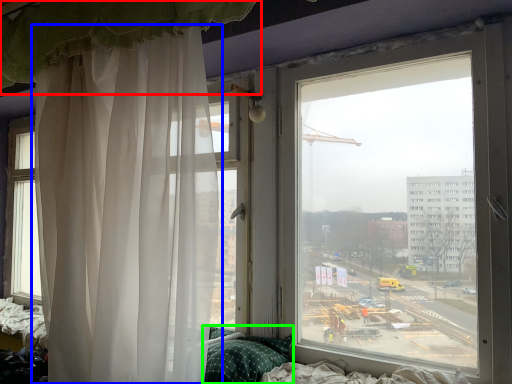
Question: Which is farther away from curtain (highlighted by a red box)? curtain (highlighted by a blue box) or pillow (highlighted by a green box)?

Choices:
 (A) curtain
 (B) pillow

Answer: (B)